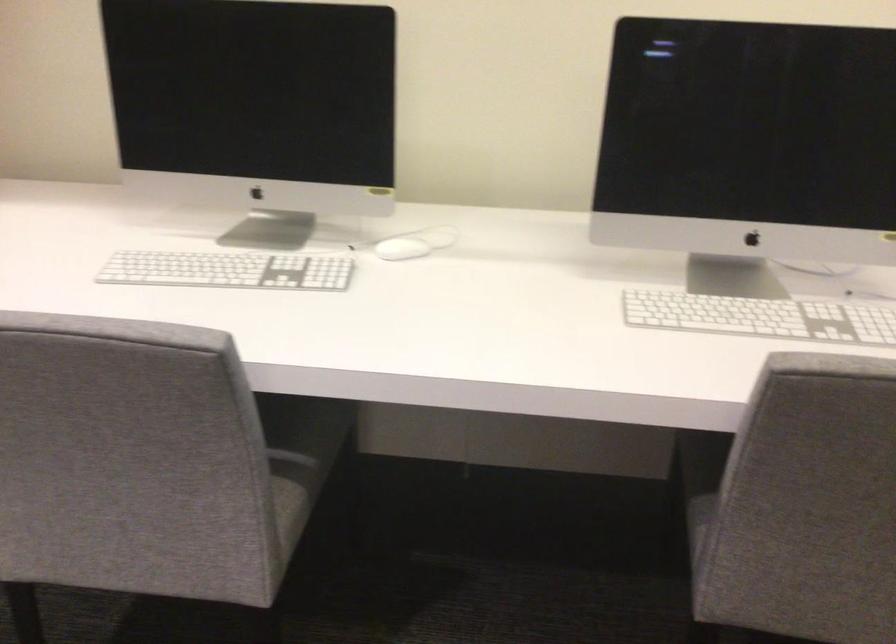
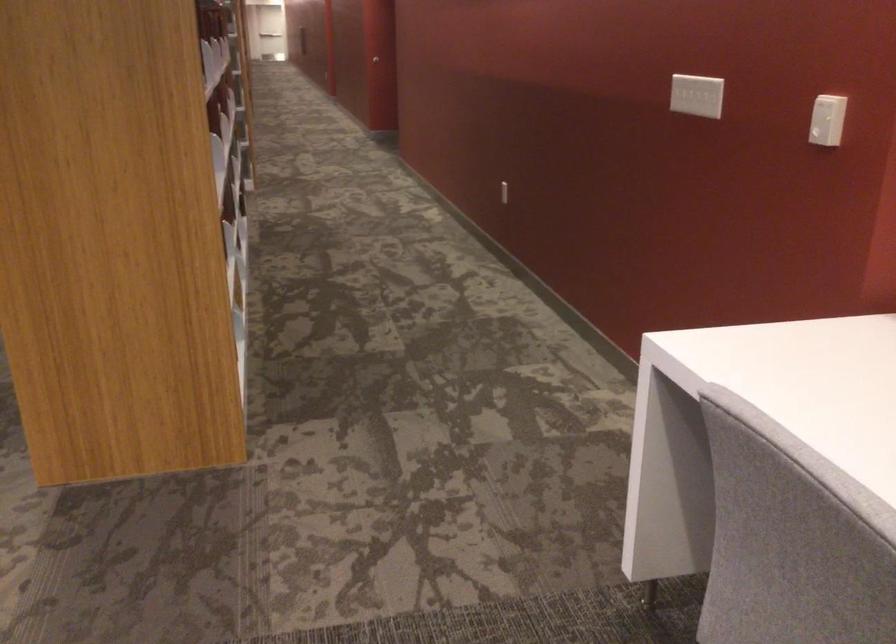
Question: The camera is either moving clockwise (left) or counter-clockwise (right) around the object. The first image is from the beginning of the video and the second image is from the end. Is the camera moving left or right when shooting the video?

Choices:
 (A) Left
 (B) Right

Answer: (B)